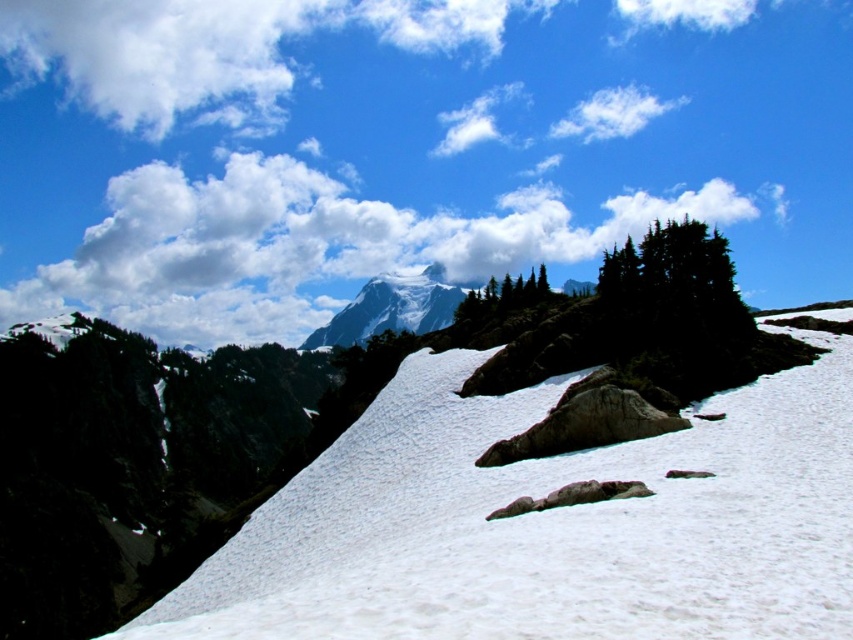
Question: Among these objects, which one is farthest from the camera?

Choices:
 (A) dark green textured tree at upper center
 (B) green matte tree at upper center

Answer: (B)

Question: Does white fluffy cloud at upper left appear under dark green textured tree at upper center?

Choices:
 (A) no
 (B) yes

Answer: (A)

Question: Can you confirm if white snow at center is positioned below white fluffy cloud at upper center?

Choices:
 (A) no
 (B) yes

Answer: (B)

Question: Which of these objects is positioned farthest from the dark green textured tree at upper center?

Choices:
 (A) white snow at center
 (B) green matte tree at upper center

Answer: (B)

Question: Which of these objects is positioned farthest from the white fluffy cloud at upper left?

Choices:
 (A) dark green textured tree at upper center
 (B) green matte tree at upper center

Answer: (B)

Question: Does white fluffy cloud at upper left appear on the left side of white fluffy cloud at upper center?

Choices:
 (A) no
 (B) yes

Answer: (B)